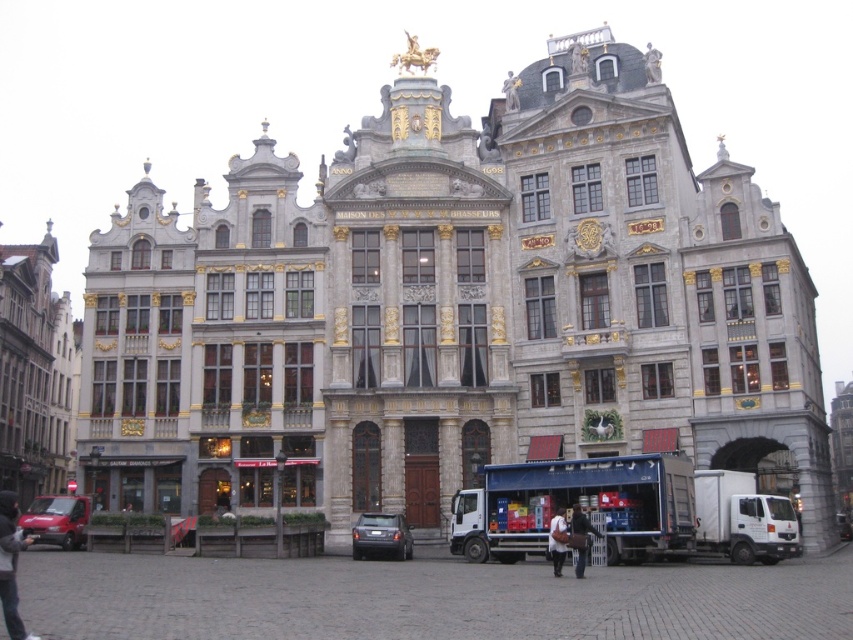
You are a tourist visiting the historical building. You see a dark gray hoodie at lower left and a dark gray metallic car at center. Which object is closer to the building?

The dark gray hoodie at lower left is closer to the building because it is located below the dark gray metallic car at center, which is further away from the building.

From the picture: You are standing in front of the historical building and want to move from the dark gray hoodie at lower left to the dark gray metallic car at center. Which direction should you move to reach the car?

You should move to the right to reach the dark gray metallic car at center from the dark gray hoodie at lower left since the dark gray hoodie at lower left is to the left of the dark gray metallic car at center.

You are an artist standing in front of the grand historical building. You notice two items in the scene that are part of a person wearing a dark brown leather jacket at lower center and a dark gray shirt at center. Which item is taller?

The dark brown leather jacket at lower center is taller than the dark gray shirt at center.